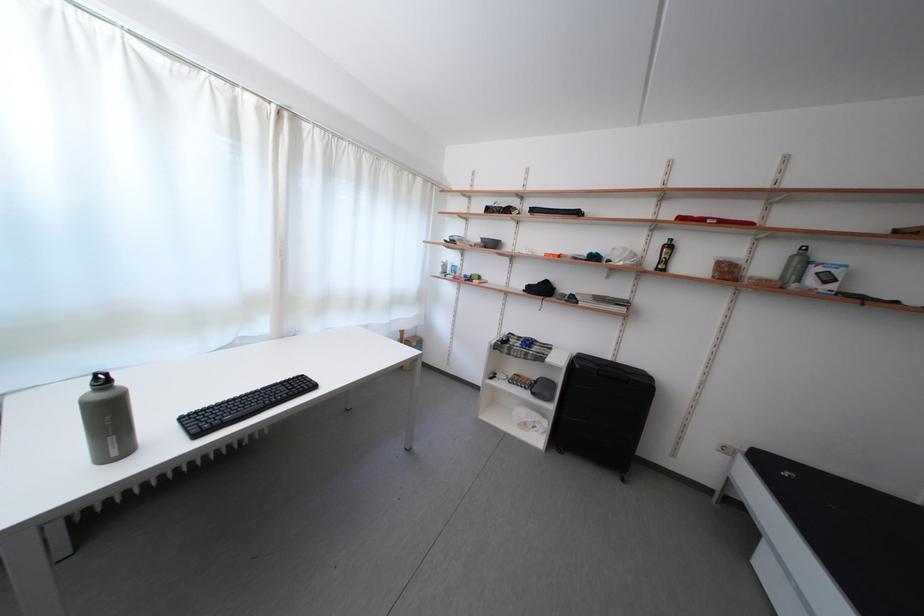
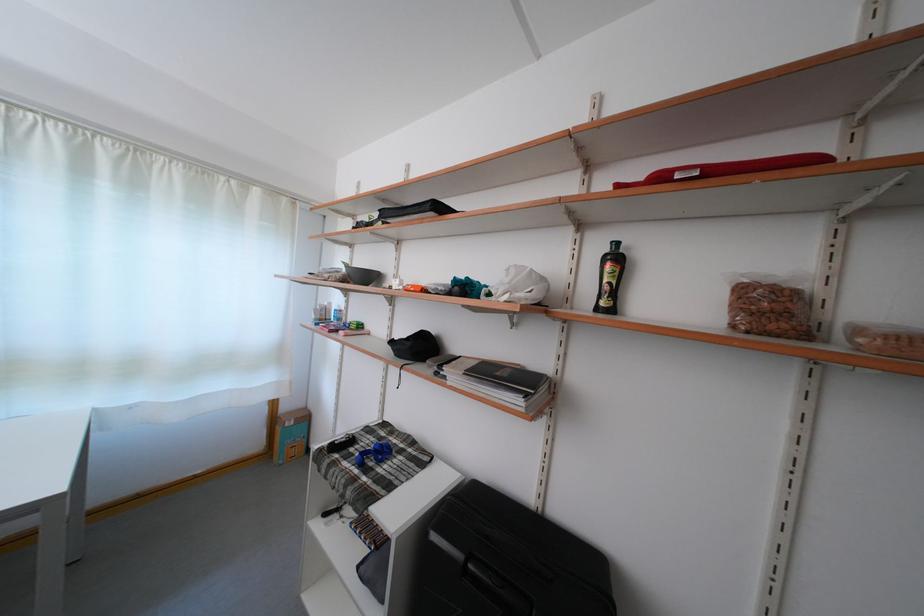
Locate, in the second image, the point that corresponds to [727,225] in the first image.

(713, 172)